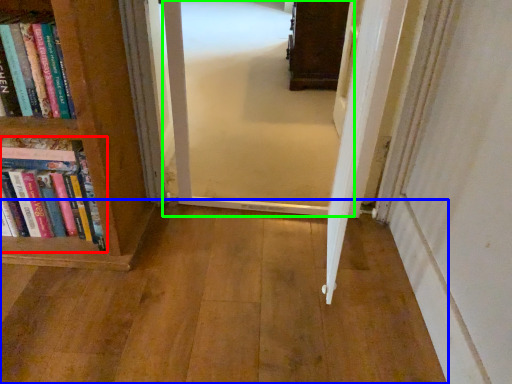
Question: Estimate the real-world distances between objects in this image. Which object is closer to book (highlighted by a red box), corridor (highlighted by a blue box) or corridor (highlighted by a green box)?

Choices:
 (A) corridor
 (B) corridor

Answer: (A)